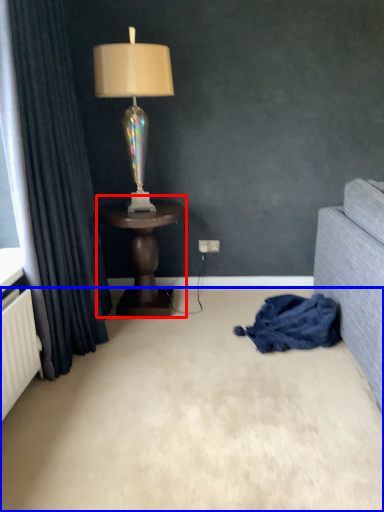
Question: Which of the following is the farthest to the observer, table (highlighted by a red box) or plain (highlighted by a blue box)?

Choices:
 (A) table
 (B) plain

Answer: (A)